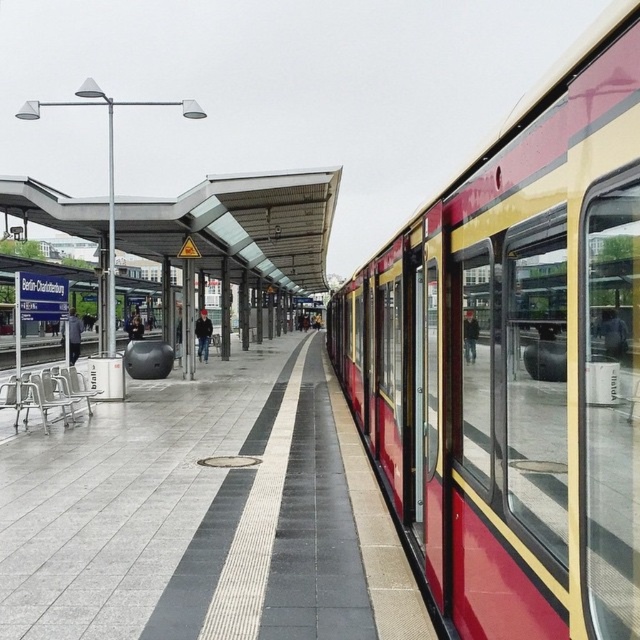
You are a passenger waiting at the Berlin Charlottenburg station. You see the red glossy train at right and the concrete platform at center. Which object is located above the other?

The red glossy train at right is positioned over the concrete platform at center, so the train is above the platform.

You are a passenger waiting at the Berlin Charlottenburg station. You see a red glossy train at right and a concrete platform at center. Which object is located to the right of the other?

The red glossy train at right is to the right of the concrete platform at center.

You are standing on the train station platform at Berlin Charlottenburg. You see two points marked on the platform. The first point is at coordinate (609, 138) and the second point is at (138, 609). Which point is closer to you?

The point at coordinate (609, 138) is closer to you than the point at (138, 609).